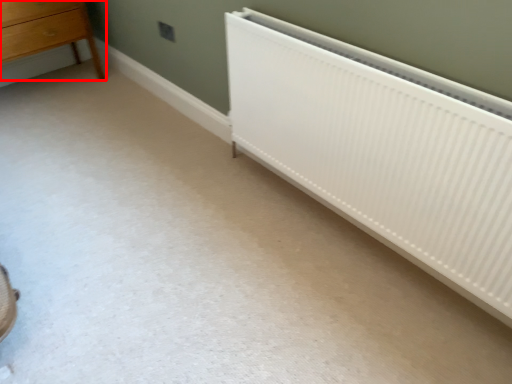
Question: In this image, where is chest of drawers (annotated by the red box) located relative to radiator?

Choices:
 (A) right
 (B) left

Answer: (B)